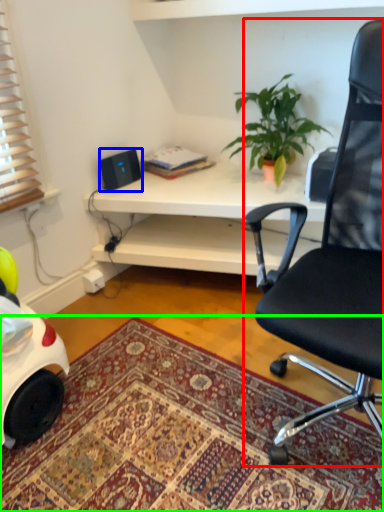
Question: Which is nearer to the chair (highlighted by a red box)? speaker (highlighted by a blue box) or mat (highlighted by a green box).

Choices:
 (A) speaker
 (B) mat

Answer: (B)